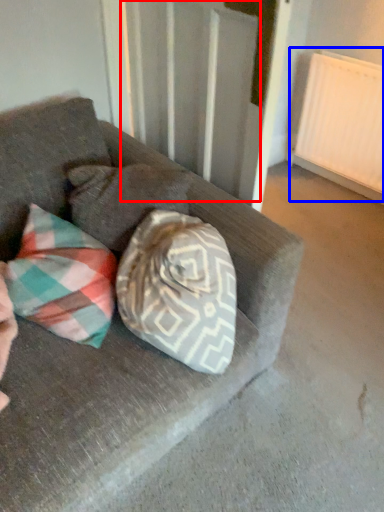
Question: Which object appears farthest to the camera in this image, curtain (highlighted by a red box) or radiator (highlighted by a blue box)?

Choices:
 (A) curtain
 (B) radiator

Answer: (B)